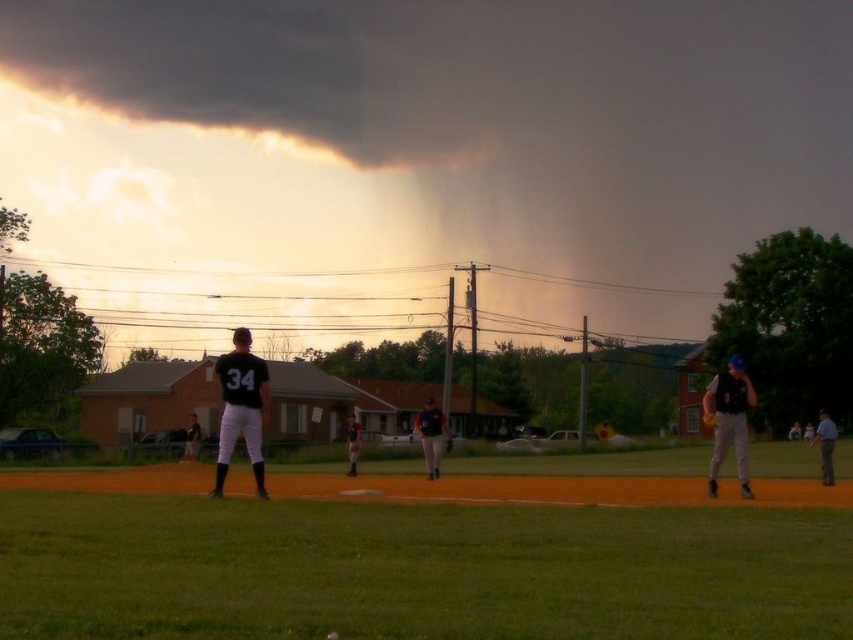
Which is more to the left, dark gray cloud at upper center or matte black baseball glove at center?

From the viewer's perspective, matte black baseball glove at center appears more on the left side.

Is point (621, 278) positioned before point (355, 424)?

That is False.

Find the location of `dark gray cloud at upper center`. dark gray cloud at upper center is located at coordinates (415, 157).

At what (x,y) coordinates should I click in order to perform the action: click on dark gray cloud at upper center. Please return your answer as a coordinate pair (x, y). This screenshot has width=853, height=640. Looking at the image, I should click on (415, 157).

Looking at this image, can you confirm if dark gray cloud at upper center is positioned below gray uniform at right?

Actually, dark gray cloud at upper center is above gray uniform at right.

Who is taller, dark gray cloud at upper center or gray uniform at right?

dark gray cloud at upper center is taller.

Locate an element on the screen. dark gray cloud at upper center is located at coordinates (415, 157).

Does dark gray cloud at upper center have a larger size compared to dark gray cloud at upper left?

Yes, dark gray cloud at upper center is bigger than dark gray cloud at upper left.

Who is positioned more to the left, dark gray cloud at upper center or dark gray cloud at upper left?

dark gray cloud at upper left is more to the left.

Which is in front, point (366, 51) or point (347, 124)?

Point (347, 124) is in front.

Identify the location of dark gray cloud at upper center. (415, 157).